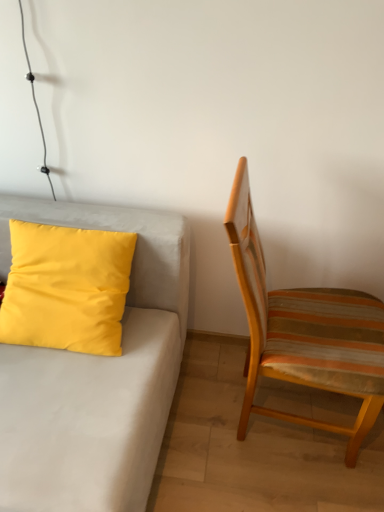
Question: From a real-world perspective, is yellow matte pillow at left on matte yellow pillow at upper left?

Choices:
 (A) no
 (B) yes

Answer: (B)

Question: Is yellow matte pillow at left looking in the opposite direction of matte yellow pillow at upper left?

Choices:
 (A) no
 (B) yes

Answer: (B)

Question: Is yellow matte pillow at left smaller than matte yellow pillow at upper left?

Choices:
 (A) no
 (B) yes

Answer: (B)

Question: Can we say yellow matte pillow at left lies outside matte yellow pillow at upper left?

Choices:
 (A) yes
 (B) no

Answer: (B)

Question: Is yellow matte pillow at left taller than matte yellow pillow at upper left?

Choices:
 (A) yes
 (B) no

Answer: (B)

Question: Considering their positions, is yellow matte pillow at left located in front of or behind matte yellow pillow at upper left?

Choices:
 (A) front
 (B) behind

Answer: (B)

Question: Choose the correct answer: Is yellow matte pillow at left inside matte yellow pillow at upper left or outside it?

Choices:
 (A) inside
 (B) outside

Answer: (A)

Question: From their relative heights in the image, would you say yellow matte pillow at left is taller or shorter than matte yellow pillow at upper left?

Choices:
 (A) short
 (B) tall

Answer: (A)

Question: From a real-world perspective, is yellow matte pillow at left physically located above or below matte yellow pillow at upper left?

Choices:
 (A) below
 (B) above

Answer: (B)

Question: Is point (77, 259) positioned closer to the camera than point (302, 375)?

Choices:
 (A) farther
 (B) closer

Answer: (A)

Question: From the image's perspective, is yellow matte pillow at left positioned above or below striped fabric chair at right?

Choices:
 (A) below
 (B) above

Answer: (B)

Question: Considering their positions, is yellow matte pillow at left located in front of or behind striped fabric chair at right?

Choices:
 (A) front
 (B) behind

Answer: (B)

Question: Based on their positions, is yellow matte pillow at left located to the left or right of striped fabric chair at right?

Choices:
 (A) right
 (B) left

Answer: (B)

Question: In terms of height, does matte yellow pillow at upper left look taller or shorter compared to yellow matte pillow at left?

Choices:
 (A) tall
 (B) short

Answer: (A)

Question: In terms of width, does matte yellow pillow at upper left look wider or thinner when compared to yellow matte pillow at left?

Choices:
 (A) wide
 (B) thin

Answer: (A)